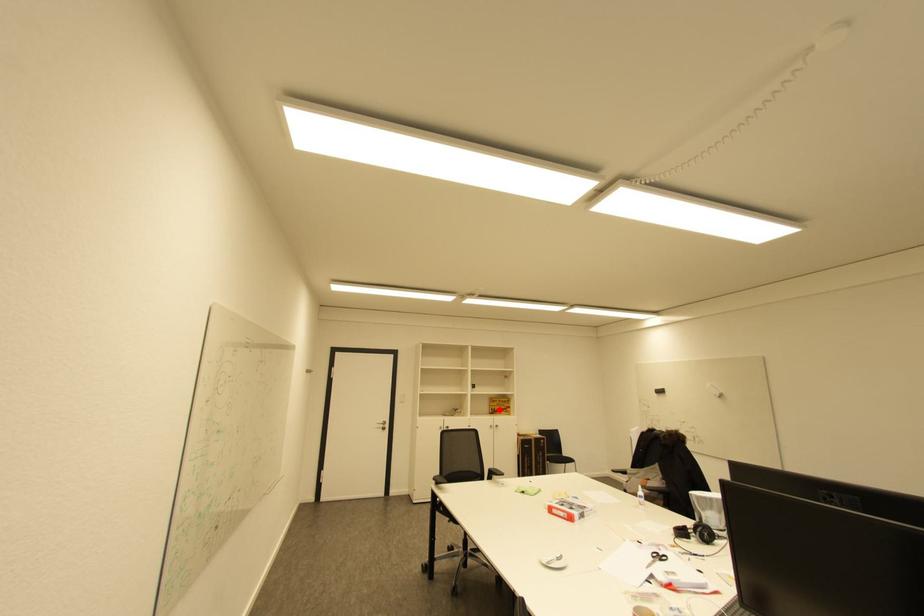
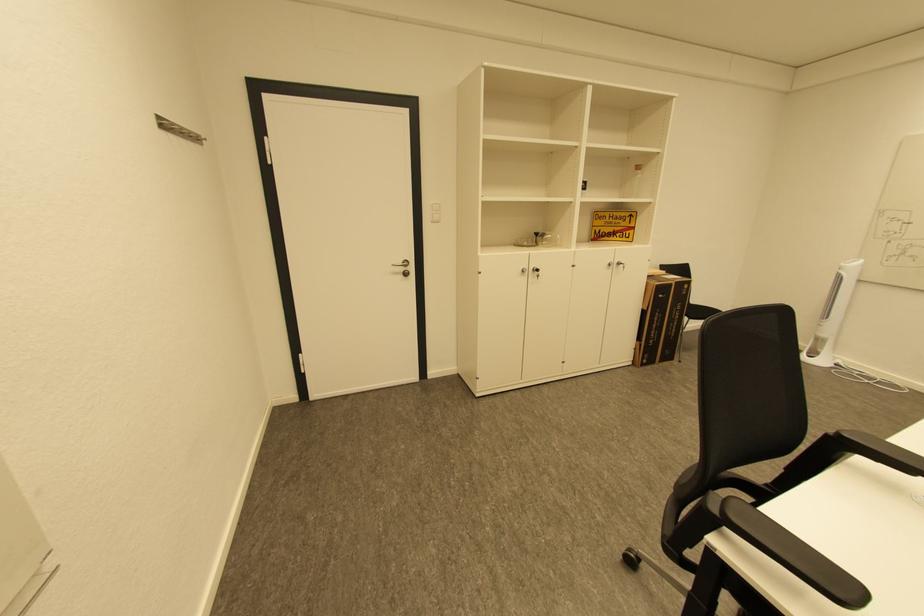
Question: I am providing you with two images of the same scene from different viewpoints. Image1 has a red point marked. In image2, the corresponding 3D location appears at what relative position? Reply with the corresponding letter.

Choices:
 (A) Closer
 (B) Farther

Answer: (A)